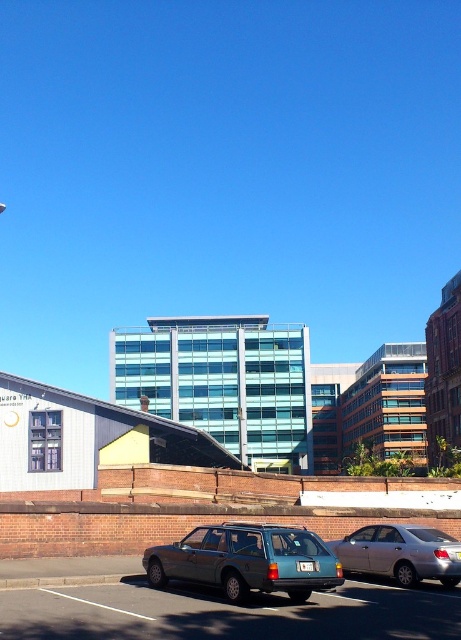
Between teal matte station wagon at center and silver metallic sedan at center, which one has more height?

Standing taller between the two is teal matte station wagon at center.

Can you confirm if teal matte station wagon at center is positioned below silver metallic sedan at center?

Actually, teal matte station wagon at center is above silver metallic sedan at center.

Who is more distant from viewer, (202, 557) or (449, 538)?

Point (449, 538)

Locate an element on the screen. teal matte station wagon at center is located at coordinates (247, 561).